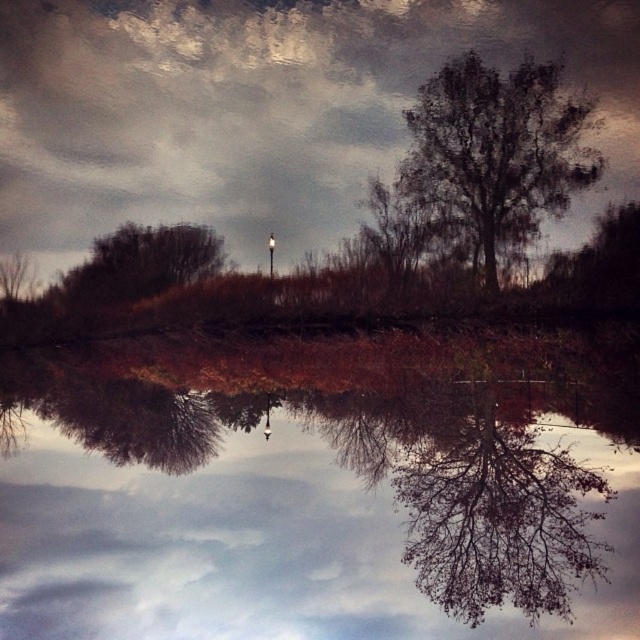
Question: Can you confirm if transparent glass water at center is positioned to the right of dark brown textured tree at upper right?

Choices:
 (A) yes
 (B) no

Answer: (B)

Question: Which point is farther from the camera taking this photo?

Choices:
 (A) (496, 570)
 (B) (269, 259)

Answer: (B)

Question: Is dark brown textured tree at upper right to the left of white glossy lamp post at upper center from the viewer's perspective?

Choices:
 (A) no
 (B) yes

Answer: (A)

Question: Estimate the real-world distances between objects in this image. Which object is farther from the white glossy lamp post at upper center?

Choices:
 (A) transparent glass water at center
 (B) cloudy sky at upper center
 (C) dark brown textured tree at upper right

Answer: (C)

Question: Is the position of transparent glass water at center more distant than that of cloudy sky at upper center?

Choices:
 (A) no
 (B) yes

Answer: (A)

Question: Which of the following is the closest to the observer?

Choices:
 (A) (20, 136)
 (B) (506, 189)

Answer: (B)